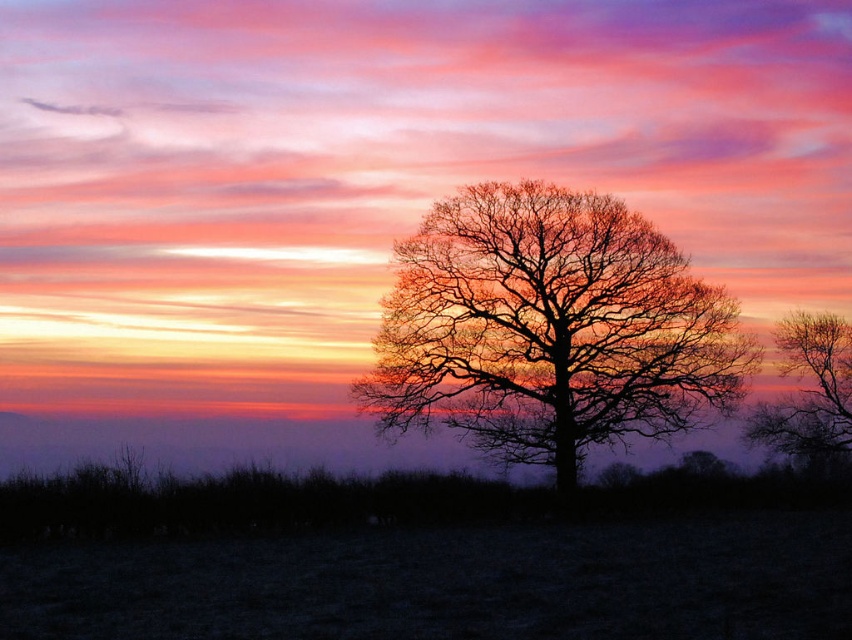
You are an artist trying to paint the sunset scene. You notice two elements in the center of the image, the bare branches at center and the silhouette bare tree at center. Which one should you focus on to capture the most prominent feature of the scene?

The bare branches at center has a larger size compared to the silhouette bare tree at center, so you should focus on the bare branches at center to capture the most prominent feature of the scene.

You are an astronomer studying the position of celestial objects in the sunset scene. You notice the bare branches at center. Can you determine their exact coordinates in the image?

The bare branches at center are located at coordinates point (550, 328).

You are standing in front of the sunset scene and notice two points in the sky. The first point is located at coordinates point (654,422) and the second at point (798,424). Which of these two points appears closer to you?

Point (654,422) is closer to the camera than point (798,424), so the first point appears closer to you.